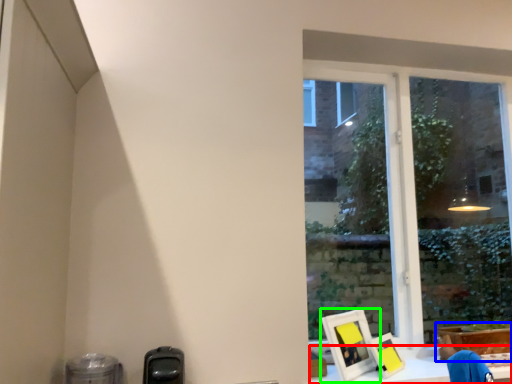
Question: Which object is positioned closest to workbench (highlighted by a red box)? Select from cardboard box (highlighted by a blue box) and picture frame (highlighted by a green box).

Choices:
 (A) cardboard box
 (B) picture frame

Answer: (B)